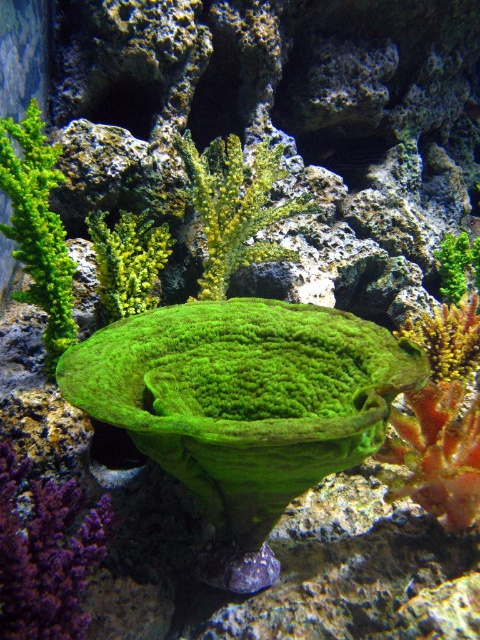
Does green fuzzy coral at center have a greater height compared to green fuzzy coral at upper right?

Yes.

Is green fuzzy coral at center shorter than green fuzzy coral at upper right?

No.

Who is more forward, [211,260] or [465,252]?

Point [211,260] is more forward.

Where is `green fuzzy coral at center`? This screenshot has height=640, width=480. green fuzzy coral at center is located at coordinates (236, 205).

Is point (47, 218) closer to camera compared to point (128, 220)?

Yes.

What do you see at coordinates (37, 227) in the screenshot?
I see `green fuzzy plant at left` at bounding box center [37, 227].

Image resolution: width=480 pixels, height=640 pixels. Find the location of `green fuzzy plant at left`. green fuzzy plant at left is located at coordinates (37, 227).

Is point (116, 298) positioned before point (450, 250)?

Yes, it is in front of point (450, 250).

Does green fuzzy plant at upper center have a greater height compared to green fuzzy coral at upper right?

Correct, green fuzzy plant at upper center is much taller as green fuzzy coral at upper right.

What do you see at coordinates (128, 262) in the screenshot? I see `green fuzzy plant at upper center` at bounding box center [128, 262].

Locate an element on the screen. This screenshot has height=640, width=480. green fuzzy plant at upper center is located at coordinates (128, 262).